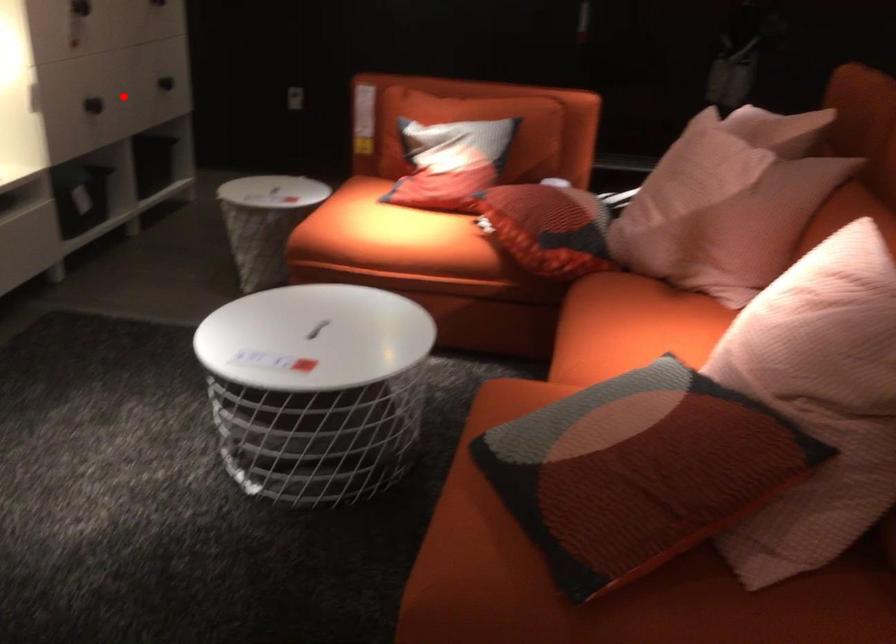
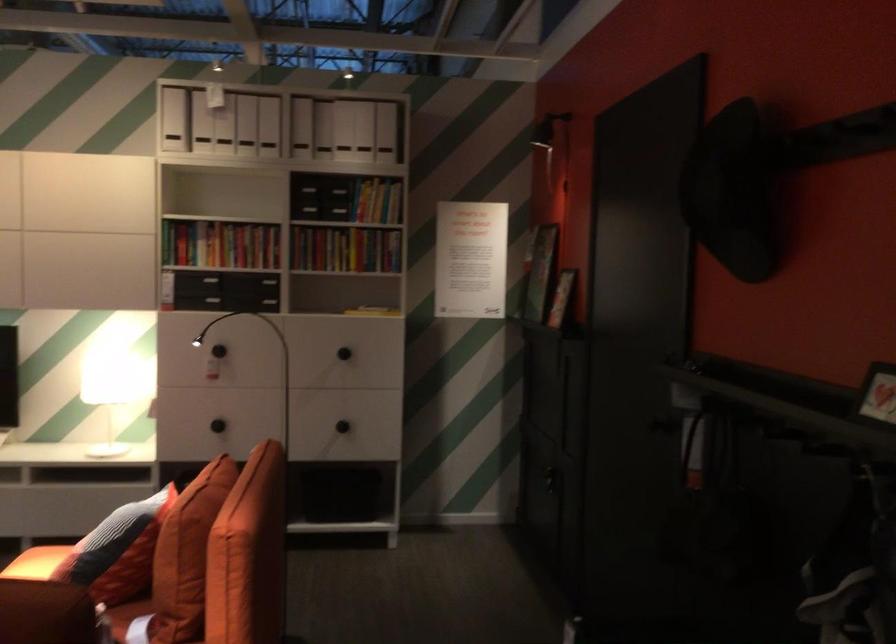
Question: I am providing you with two images of the same scene from different viewpoints. In image1, a red point is highlighted. Considering the same 3D point in image2, which of the following is correct?

Choices:
 (A) It is closer
 (B) It is farther

Answer: (B)